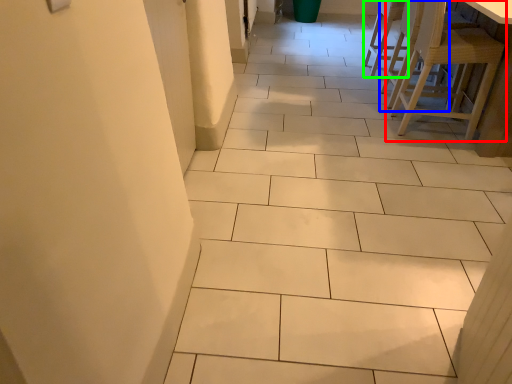
Question: Considering the real-world distances, which object is closest to chair (highlighted by a red box)? chair (highlighted by a blue box) or chair (highlighted by a green box).

Choices:
 (A) chair
 (B) chair

Answer: (A)